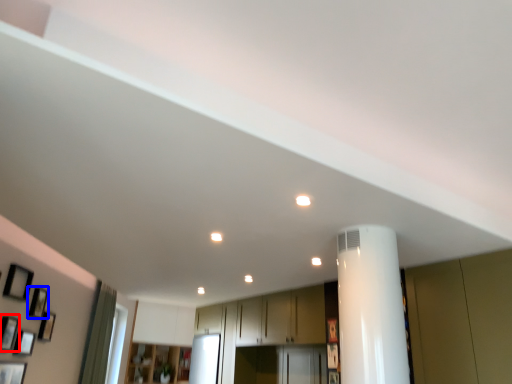
Question: Which point is further to the camera, picture frame (highlighted by a red box) or picture frame (highlighted by a blue box)?

Choices:
 (A) picture frame
 (B) picture frame

Answer: (B)